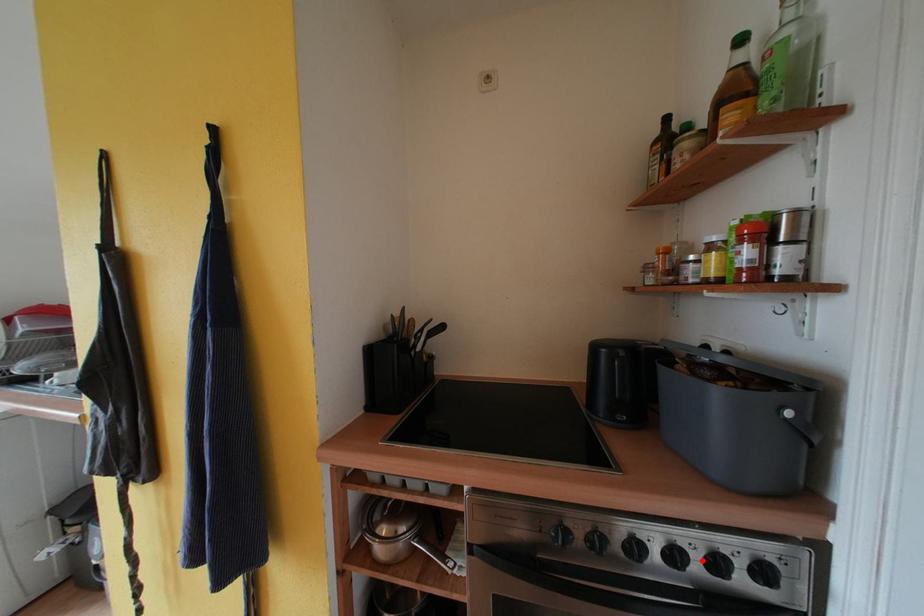
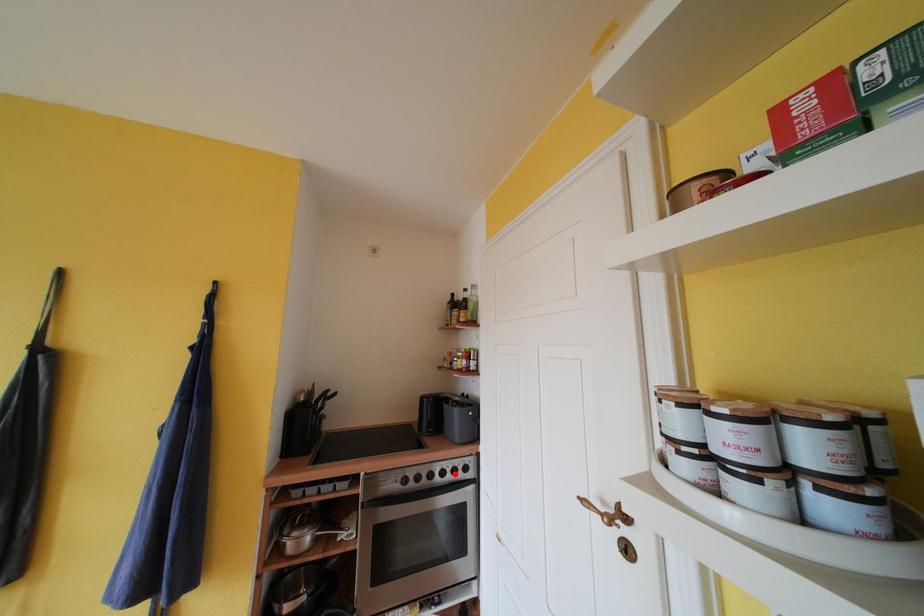
I am providing you with two images of the same scene from different viewpoints. A red point is marked on the first image and another point is marked on the second image. Does the point marked in image1 correspond to the same location as the one in image2?

Yes